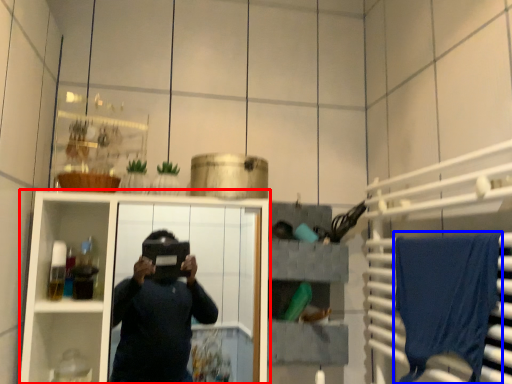
Question: Which object is closer to the camera taking this photo, cabinetry (highlighted by a red box) or bath towel (highlighted by a blue box)?

Choices:
 (A) cabinetry
 (B) bath towel

Answer: (B)